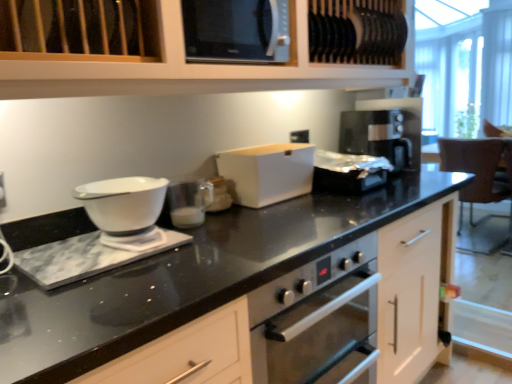
Question: In terms of height, does brown leather chair at right look taller or shorter compared to silver metallic toaster at center, which is the 1th appliance from right to left?

Choices:
 (A) tall
 (B) short

Answer: (A)

Question: Based on their sizes in the image, would you say brown leather chair at right is bigger or smaller than silver metallic toaster at center, which is the 1th appliance from right to left?

Choices:
 (A) big
 (B) small

Answer: (A)

Question: Which object is positioned closest to the black glossy microwave at upper center?

Choices:
 (A) white glossy bowl at left, which is the second kitchen appliance from back to front
 (B) matte glass jar at center, which ranks as the second appliance in left-to-right order
 (C) white matte breadbox at center, acting as the 1th kitchen appliance starting from the back
 (D) white matte cabinet at upper center
 (E) brown leather chair at right

Answer: (D)

Question: Considering the real-world distances, which object is closest to the white glossy bowl at left, the first kitchen appliance from the front?

Choices:
 (A) white glossy measuring cup at center, which is counted as the 1th appliance, starting from the left
 (B) white matte cabinet at upper center
 (C) black glossy microwave at upper center
 (D) brown leather chair at right
 (E) silver metallic toaster at center, the 1th appliance from the back

Answer: (A)